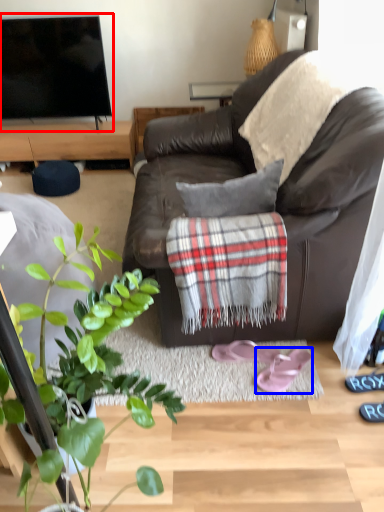
Question: Among these objects, which one is nearest to the camera, television (highlighted by a red box) or footwear (highlighted by a blue box)?

Choices:
 (A) television
 (B) footwear

Answer: (B)